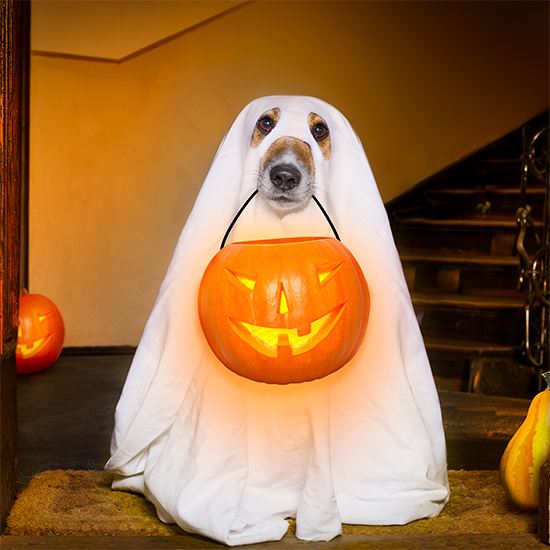
In order to click on handle in this screenshot , I will do `click(316, 202)`.